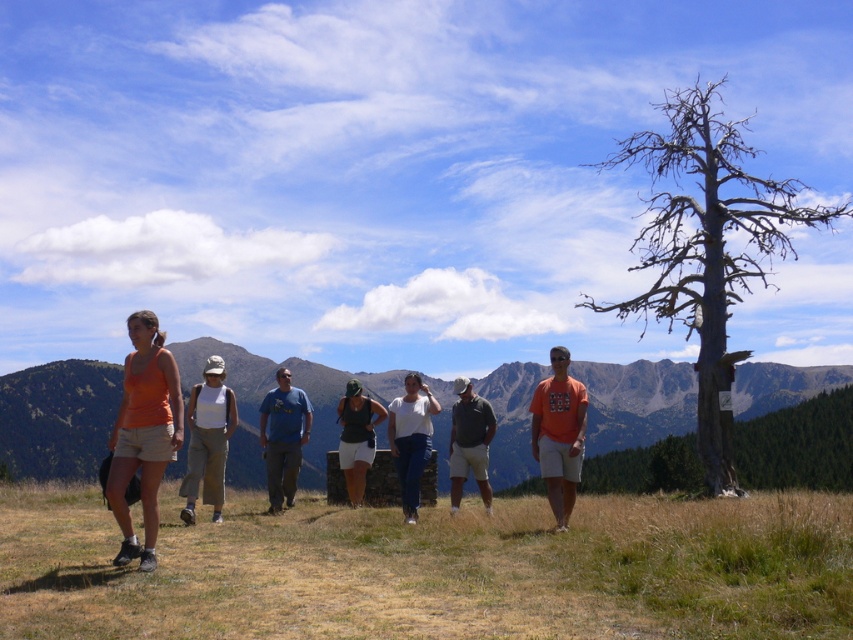
Is dry grass at lower center positioned behind orange cotton t-shirt at center?

No, dry grass at lower center is closer to the viewer.

Is point (421, 625) more distant than point (582, 401)?

No, (421, 625) is closer to viewer.

You are a GUI agent. You are given a task and a screenshot of the screen. Output one action in this format:
    pyautogui.click(x=<x>, y=<y>)
    Task: Click on the dry grass at lower center
    Image resolution: width=853 pixels, height=640 pixels.
    Given the screenshot: What is the action you would take?
    pyautogui.click(x=434, y=570)

In the scene shown: Can you confirm if orange cotton t-shirt at center is wider than white matte shirt at center?

In fact, orange cotton t-shirt at center might be narrower than white matte shirt at center.

Consider the image. Can you confirm if orange cotton t-shirt at center is positioned to the right of white matte shirt at center?

Correct, you'll find orange cotton t-shirt at center to the right of white matte shirt at center.

Find the location of a particular element. orange cotton t-shirt at center is located at coordinates (558, 433).

Between point (488, 509) and point (341, 403), which one is positioned in front?

Point (488, 509) is more forward.

Which is behind, point (469, 419) or point (361, 442)?

The point (361, 442) is behind.

Find the location of `gray cotton shirt at center`. gray cotton shirt at center is located at coordinates (469, 442).